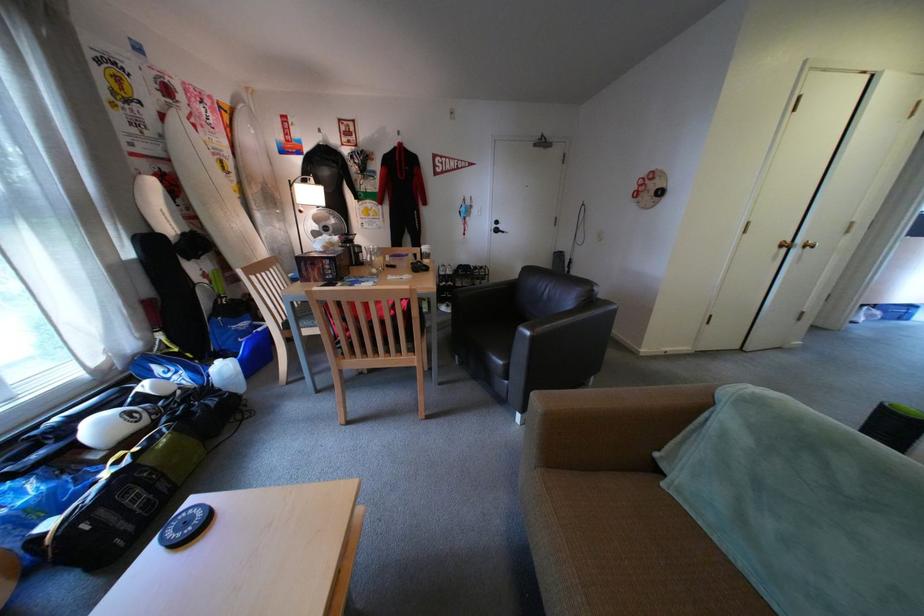
What are the coordinates of `black circular coaster` in the screenshot? It's located at (186, 525).